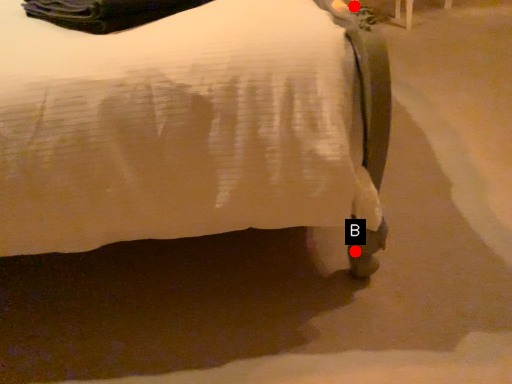
Question: Two points are circled on the image, labeled by A and B beside each circle. Among these points, which one is nearest to the camera?

Choices:
 (A) A is closer
 (B) B is closer

Answer: (B)